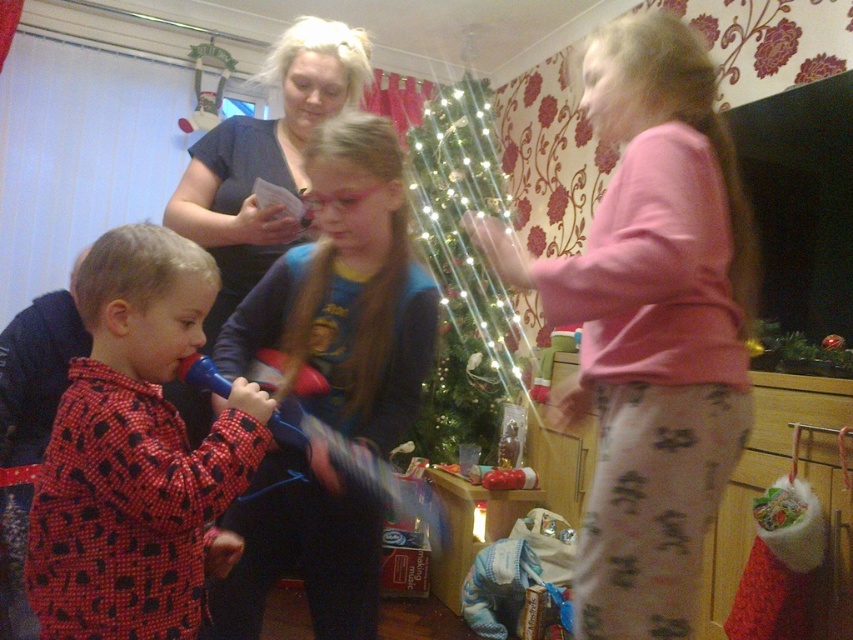
How far apart are red dotted pajamas at left and green shiny christmas tree at center?

red dotted pajamas at left is 2.52 meters from green shiny christmas tree at center.

Between red dotted pajamas at left and green shiny christmas tree at center, which one has less height?

red dotted pajamas at left

Is point (111, 387) positioned before point (486, 128)?

Yes, point (111, 387) is in front of point (486, 128).

This screenshot has width=853, height=640. In order to click on red dotted pajamas at left in this screenshot , I will do `click(137, 452)`.

Does point (695, 397) come farther from viewer compared to point (392, 275)?

No, it is not.

Can you confirm if pink cotton pajamas at upper right is positioned below blue cotton shirt at center?

Incorrect, pink cotton pajamas at upper right is not positioned below blue cotton shirt at center.

Is point (726, 193) positioned before point (283, 291)?

Yes, point (726, 193) is in front of point (283, 291).

Identify the location of pink cotton pajamas at upper right. (650, 326).

Does red dotted pajamas at left appear on the right side of blue cotton shirt at center?

In fact, red dotted pajamas at left is to the left of blue cotton shirt at center.

Between red dotted pajamas at left and blue cotton shirt at center, which one appears on the left side from the viewer's perspective?

Positioned to the left is red dotted pajamas at left.

This screenshot has height=640, width=853. I want to click on red dotted pajamas at left, so click(137, 452).